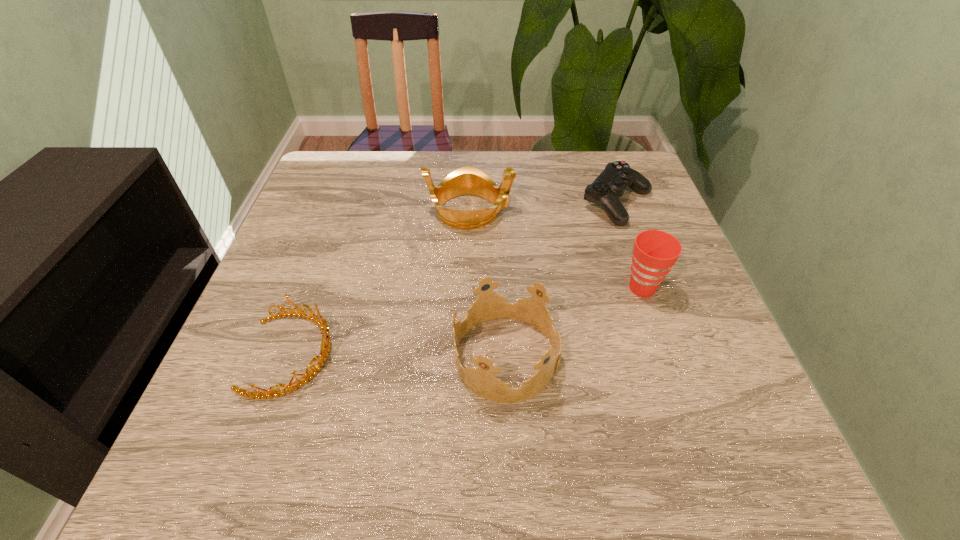
Locate which object ranks third in proximity to the cup. Please provide its 2D coordinates. Your answer should be formatted as a tuple, i.e. [(x, y)], where the tuple contains the x and y coordinates of a point satisfying the conditions above.

[(467, 180)]

The image size is (960, 540). Find the location of `tiara that can be found as the second closest to the cup`. tiara that can be found as the second closest to the cup is located at coordinates (467, 180).

At what (x,y) coordinates should I click in order to perform the action: click on the closest tiara to the farthest tiara. Please return your answer as a coordinate pair (x, y). This screenshot has height=540, width=960. Looking at the image, I should click on (488, 305).

Where is `free point that satisfies the following two spatial constraints: 1. at the front emblem of the cup; 2. on the left side of the farthest tiara`? free point that satisfies the following two spatial constraints: 1. at the front emblem of the cup; 2. on the left side of the farthest tiara is located at coordinates (468, 288).

Where is `free point that satisfies the following two spatial constraints: 1. on the back side of the control; 2. on the left side of the third nearest object`? This screenshot has height=540, width=960. free point that satisfies the following two spatial constraints: 1. on the back side of the control; 2. on the left side of the third nearest object is located at coordinates (612, 204).